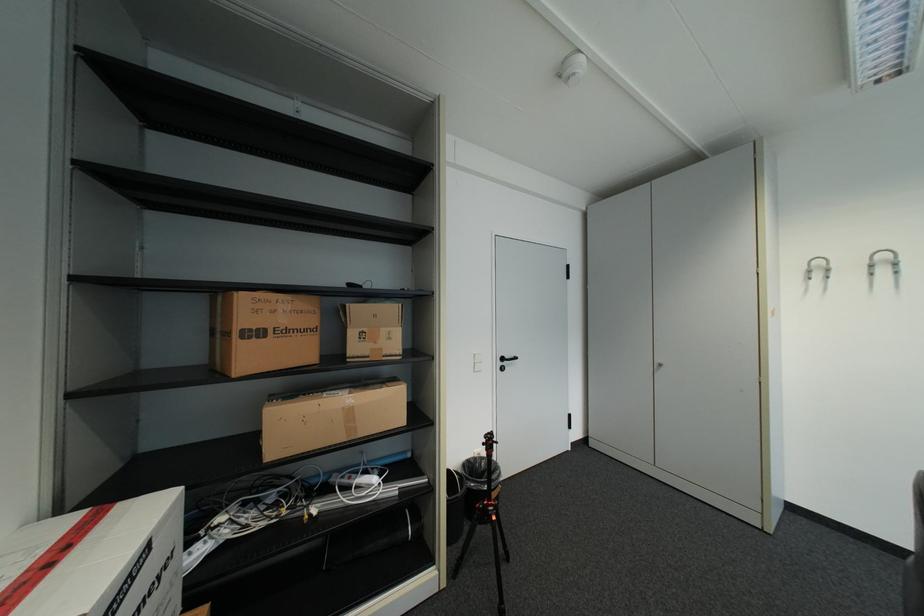
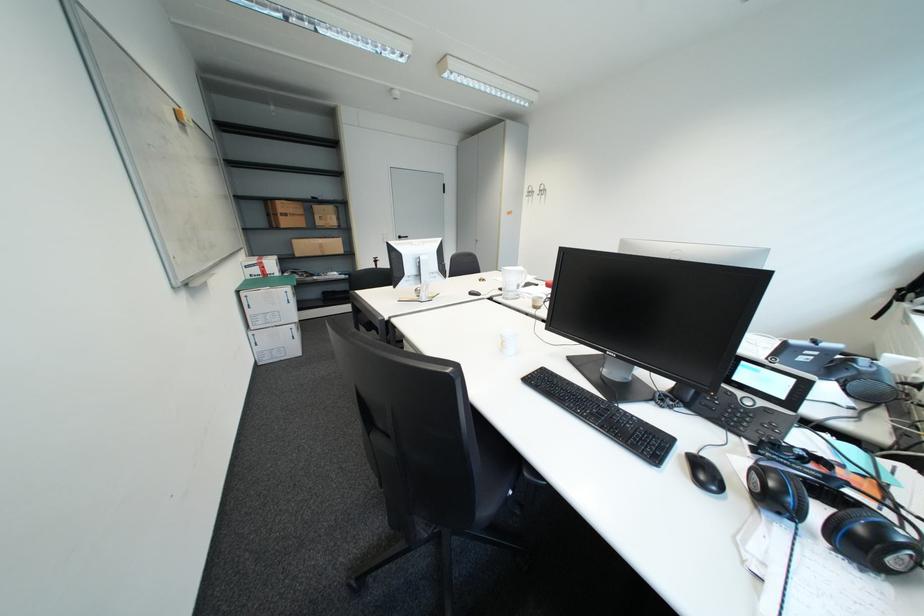
Which direction would the cameraman need to move to produce the second image?

The cameraman moved toward right, backward.